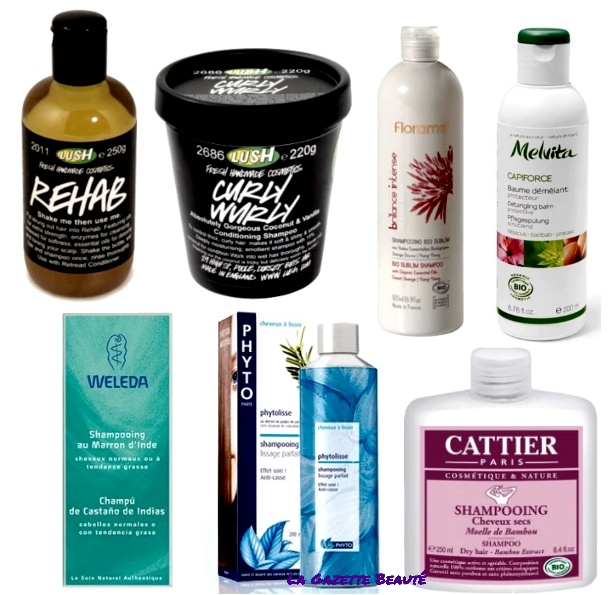
You are a GUI agent. You are given a task and a screenshot of the screen. Output one action in this format:
    pyautogui.click(x=<x>, y=<y>)
    Task: Click on the 5 bottles with caps
    This screenshot has width=616, height=595.
    Given the screenshot: What is the action you would take?
    pyautogui.click(x=55, y=195), pyautogui.click(x=419, y=206), pyautogui.click(x=524, y=242), pyautogui.click(x=490, y=435), pyautogui.click(x=344, y=481)